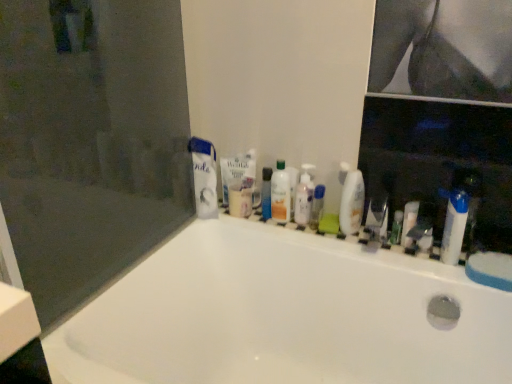
Question: Is white glossy ledge at upper center taller than blue plastic tube at center, the first toiletry in the left-to-right sequence?

Choices:
 (A) yes
 (B) no

Answer: (B)

Question: Can you confirm if white glossy ledge at upper center is shorter than blue plastic tube at center, the first toiletry in the left-to-right sequence?

Choices:
 (A) no
 (B) yes

Answer: (B)

Question: From the image's perspective, is white glossy ledge at upper center below blue plastic tube at center, the 6th toiletry positioned from the right?

Choices:
 (A) yes
 (B) no

Answer: (A)

Question: From a real-world perspective, is white glossy ledge at upper center positioned under blue plastic tube at center, the 6th toiletry positioned from the right, based on gravity?

Choices:
 (A) yes
 (B) no

Answer: (A)

Question: Is blue plastic tube at center, the 6th toiletry positioned from the right, a part of white glossy ledge at upper center?

Choices:
 (A) yes
 (B) no

Answer: (B)

Question: Is white glossy ledge at upper center positioned with its back to blue plastic tube at center, the 6th toiletry positioned from the right?

Choices:
 (A) no
 (B) yes

Answer: (A)

Question: From the image's perspective, is transparent plastic bottle at center, positioned as the 2th mouthwash in left-to-right order, on transparent glass screen door at upper left?

Choices:
 (A) yes
 (B) no

Answer: (B)

Question: Is transparent plastic bottle at center, placed as the second mouthwash when sorted from right to left, facing away from transparent glass screen door at upper left?

Choices:
 (A) yes
 (B) no

Answer: (B)

Question: From a real-world perspective, does transparent plastic bottle at center, placed as the second mouthwash when sorted from right to left, stand above transparent glass screen door at upper left?

Choices:
 (A) yes
 (B) no

Answer: (B)

Question: Does transparent plastic bottle at center, placed as the second mouthwash when sorted from right to left, have a lesser width compared to transparent glass screen door at upper left?

Choices:
 (A) yes
 (B) no

Answer: (A)

Question: Does transparent plastic bottle at center, placed as the second mouthwash when sorted from right to left, lie behind transparent glass screen door at upper left?

Choices:
 (A) yes
 (B) no

Answer: (A)

Question: Does transparent plastic bottle at center, placed as the second mouthwash when sorted from right to left, appear on the left side of transparent glass screen door at upper left?

Choices:
 (A) no
 (B) yes

Answer: (A)

Question: Is transparent glass screen door at upper left facing away from metallic silver razor at center, which appears as the 4th toiletry when viewed from the right?

Choices:
 (A) yes
 (B) no

Answer: (B)